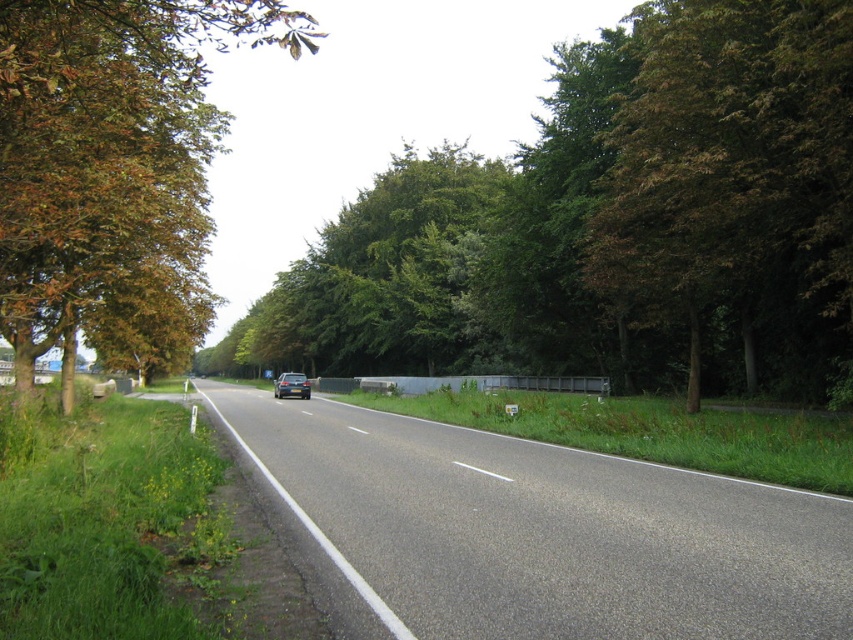
You are standing on the side of the road and see the green leafy tree at center and the brown leafy tree at left. Which tree is positioned more to the right side of the road?

The green leafy tree at center is positioned more to the right side of the road than the brown leafy tree at left.

You are driving a car and see the asphalt road at center and the green leafy tree at right. Which object is positioned lower in the image?

The asphalt road at center is located below the green leafy tree at right, so the asphalt road at center is positioned lower in the image.

You are standing at the starting point of the road and want to walk to the green leafy tree at right. Based on the coordinates provided, in which direction should you head relative to the road?

The green leafy tree at right is located at coordinates point (735, 188). Since the tree is at the right side of the road, you should head towards the right side of the road to reach it.